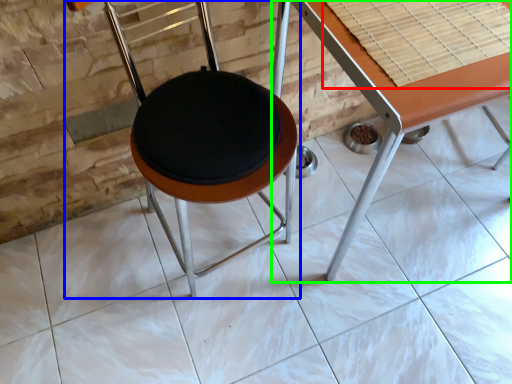
Question: Which is nearer to the table top (highlighted by a red box)? chair (highlighted by a blue box) or table (highlighted by a green box).

Choices:
 (A) chair
 (B) table

Answer: (B)